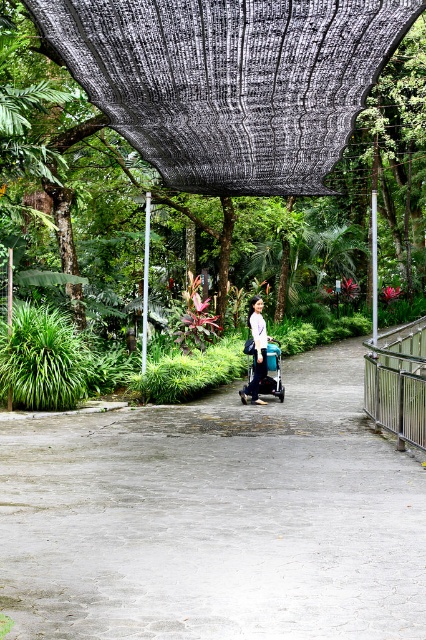
Is white fabric bag at center smaller than blue fabric stroller at center?

Yes, white fabric bag at center is smaller than blue fabric stroller at center.

Between white fabric bag at center and blue fabric stroller at center, which one is positioned higher?

blue fabric stroller at center is above.

This screenshot has height=640, width=426. In order to click on white fabric bag at center in this screenshot , I will do `click(256, 349)`.

Where is `white fabric bag at center`? white fabric bag at center is located at coordinates (256, 349).

Is gray concrete path at center thinner than black mesh canopy at upper center?

In fact, gray concrete path at center might be wider than black mesh canopy at upper center.

Find the location of a particular element. The image size is (426, 640). gray concrete path at center is located at coordinates (215, 518).

Which is behind, point (158, 502) or point (264, 96)?

The point (264, 96) is more distant.

Locate an element on the screen. gray concrete path at center is located at coordinates (215, 518).

Is matte black stroller at center further to the viewer compared to white fabric bag at center?

That is False.

Is matte black stroller at center shorter than white fabric bag at center?

Yes, matte black stroller at center is shorter than white fabric bag at center.

Locate an element on the screen. This screenshot has width=426, height=640. matte black stroller at center is located at coordinates (230, 81).